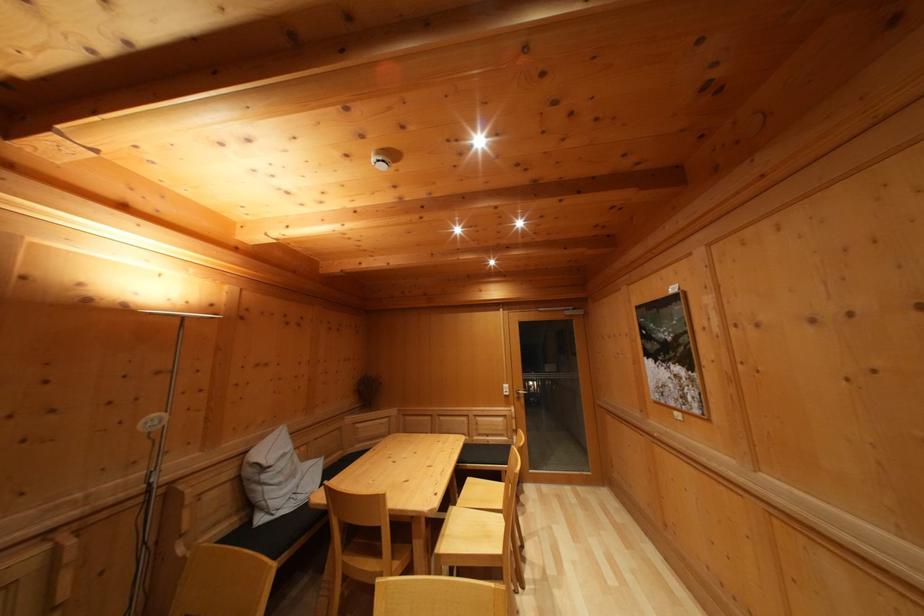
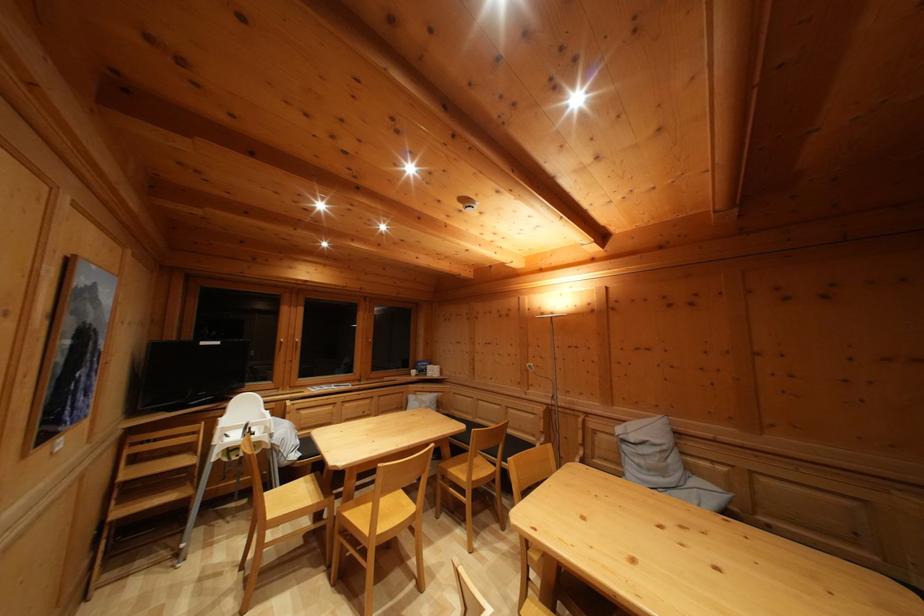
The point at (270, 484) is marked in the first image. Where is the corresponding point in the second image?

(629, 454)